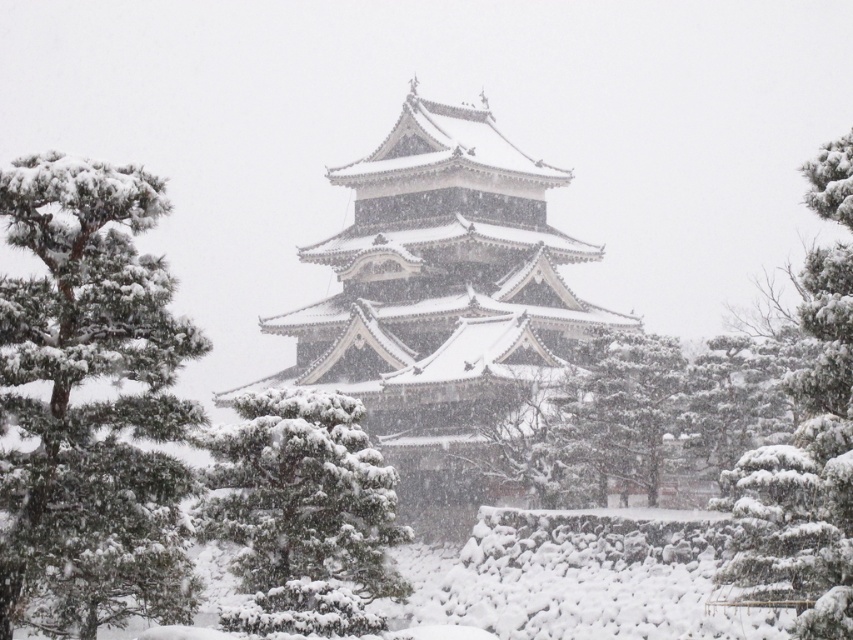
Does green textured pine at center appear on the left side of snow-covered pine at right?

Indeed, green textured pine at center is positioned on the left side of snow-covered pine at right.

Locate an element on the screen. green textured pine at center is located at coordinates (303, 515).

Who is more forward, (347, 433) or (746, 467)?

Positioned in front is point (347, 433).

Locate an element on the screen. green textured pine at center is located at coordinates (303, 515).

Which is more to the right, green matte pine at left or green textured pine at center?

green textured pine at center is more to the right.

Between point (97, 566) and point (277, 483), which one is positioned behind?

The point (277, 483) is more distant.

Who is more distant from viewer, (171, 493) or (280, 432)?

The point (280, 432) is more distant.

Identify the location of green matte pine at left. The width and height of the screenshot is (853, 640). (90, 404).

Can you confirm if green matte pine at left is shorter than snow-covered pine at right?

No.

Based on the photo, how distant is green matte pine at left from snow-covered pine at right?

A distance of 18.24 meters exists between green matte pine at left and snow-covered pine at right.

Find the location of `green matte pine at left`. green matte pine at left is located at coordinates (90, 404).